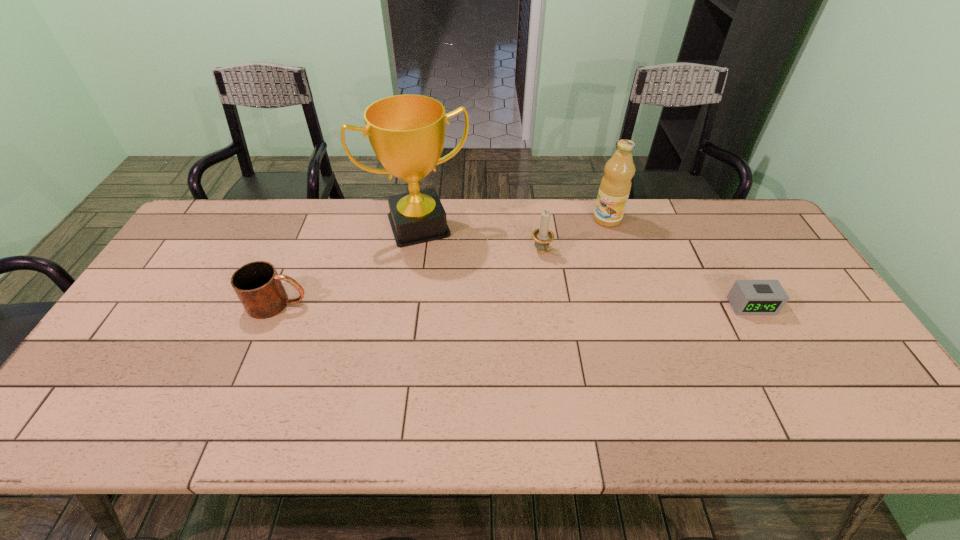
Locate an element on the screen. unoccupied position between the leftmost object and the award is located at coordinates (348, 265).

I want to click on free space between the mug and the fourth shortest object, so click(443, 261).

What are the coordinates of `free space between the tallest object and the leftmost object` in the screenshot? It's located at (348, 265).

I want to click on vacant space that's between the rightmost object and the second object from right to left, so pyautogui.click(x=679, y=262).

The height and width of the screenshot is (540, 960). I want to click on vacant area between the olive oil and the rightmost object, so click(x=679, y=262).

Find the location of `free space between the third object from left to right and the alarm clock`. free space between the third object from left to right and the alarm clock is located at coordinates (646, 279).

This screenshot has width=960, height=540. What are the coordinates of `unoccupied position between the second object from right to left and the mug` in the screenshot? It's located at (443, 261).

Locate an element on the screen. vacant area between the olive oil and the shortest object is located at coordinates (679, 262).

The height and width of the screenshot is (540, 960). In order to click on blank region between the mug and the fourth object from left to right in this screenshot , I will do `click(443, 261)`.

I want to click on free space between the alarm clock and the candle_holder, so click(646, 279).